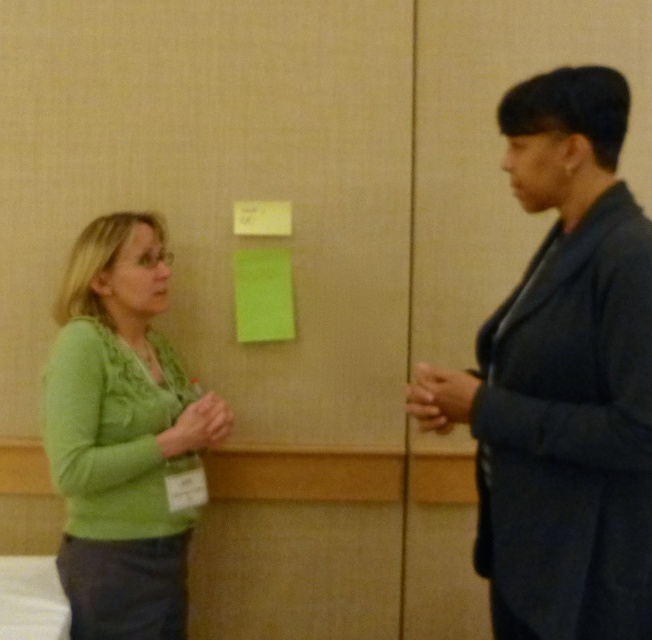
You are organizing a charity event and need to determine the order of participants based on their clothing. You see the dark blue suit at right and the green soft sweater at left. Which clothing item is placed higher in the image?

The dark blue suit at right is positioned over the green soft sweater at left, so it is placed higher in the image.

Two people are talking in an office. The person on the left is wearing a green long sleeve and the person on the right is wearing a dark blue suit at right. If the office has a 4 feet social distancing rule, can they safely talk without violating it?

The two people are 3.79 feet apart, so they are within the 4 feet social distancing rule and can talk safely without violating it.